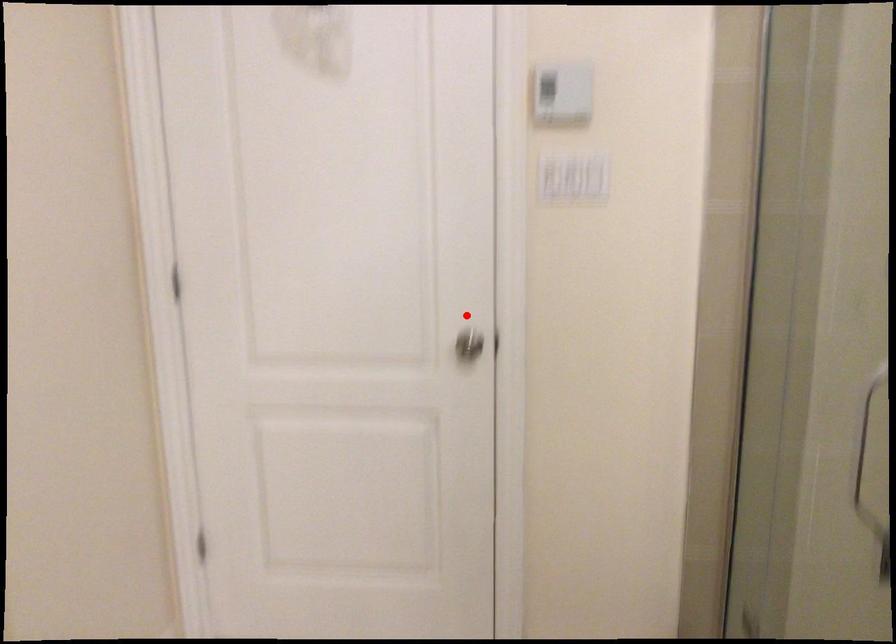
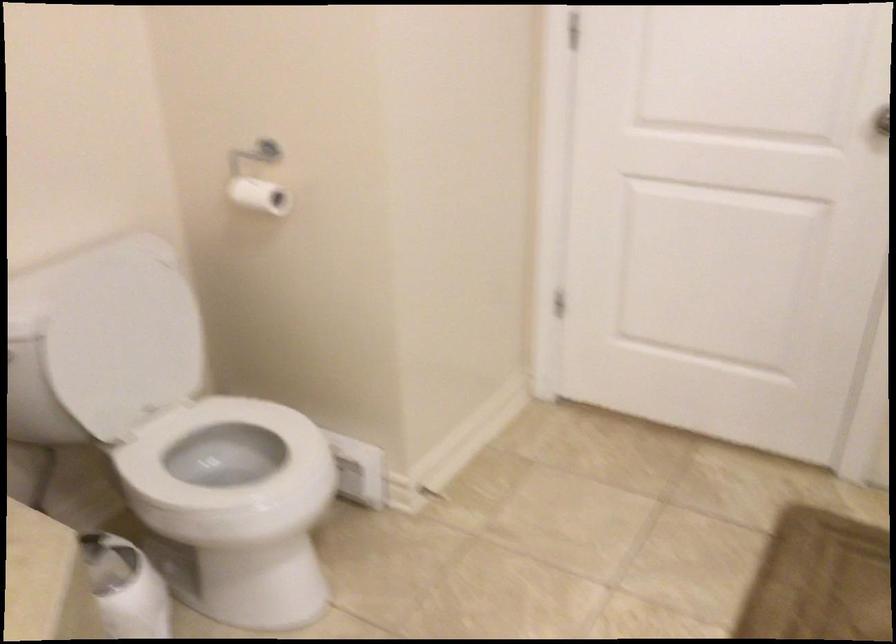
Question: I am providing you with two images of the same scene from different viewpoints. A red point is marked on the first image. Can you still see the location of the red point in image 2?

Choices:
 (A) Yes
 (B) No

Answer: (A)